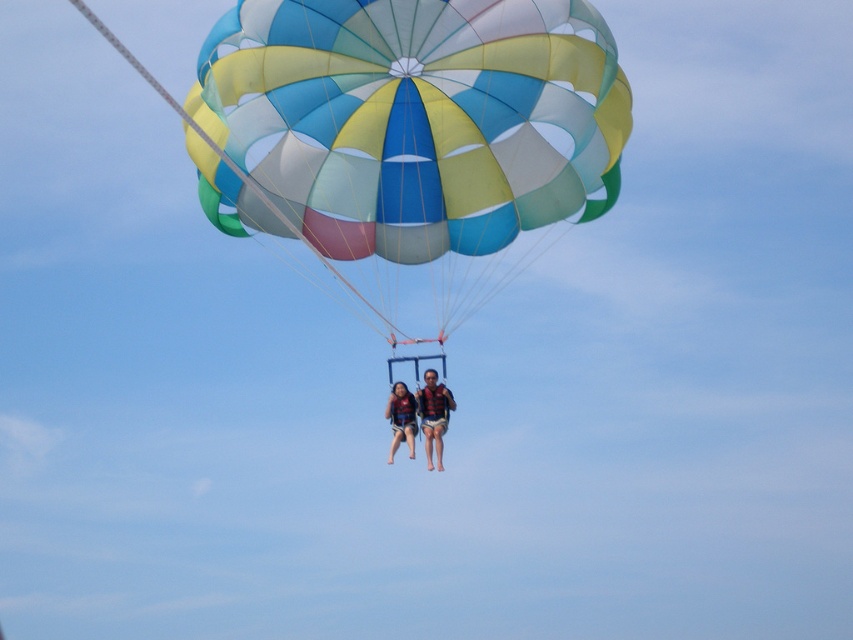
Question: Can you confirm if matte black life vest at center is bigger than matte blue life vest at center?

Choices:
 (A) yes
 (B) no

Answer: (B)

Question: Does multicolored fabric parachute at center appear on the right side of matte black life vest at center?

Choices:
 (A) no
 (B) yes

Answer: (B)

Question: Is matte black life vest at center smaller than matte blue life vest at center?

Choices:
 (A) no
 (B) yes

Answer: (B)

Question: Which point is farther to the camera?

Choices:
 (A) (447, 410)
 (B) (412, 419)
 (C) (337, 60)

Answer: (A)

Question: Which object is closer to the camera taking this photo?

Choices:
 (A) matte blue life vest at center
 (B) matte black life vest at center

Answer: (A)

Question: Considering the real-world distances, which object is farthest from the multicolored fabric parachute at center?

Choices:
 (A) matte black life vest at center
 (B) matte blue life vest at center

Answer: (A)